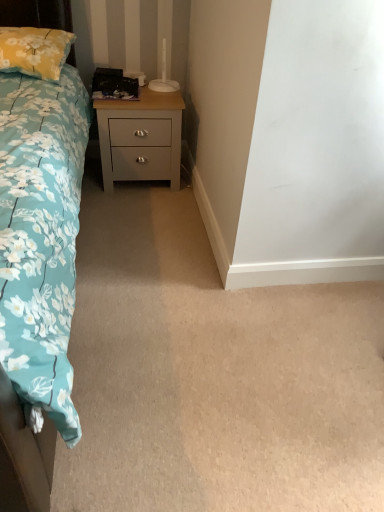
Locate an element on the screen. This screenshot has height=512, width=384. free space in front of satin gray wood nightstand at center is located at coordinates (131, 205).